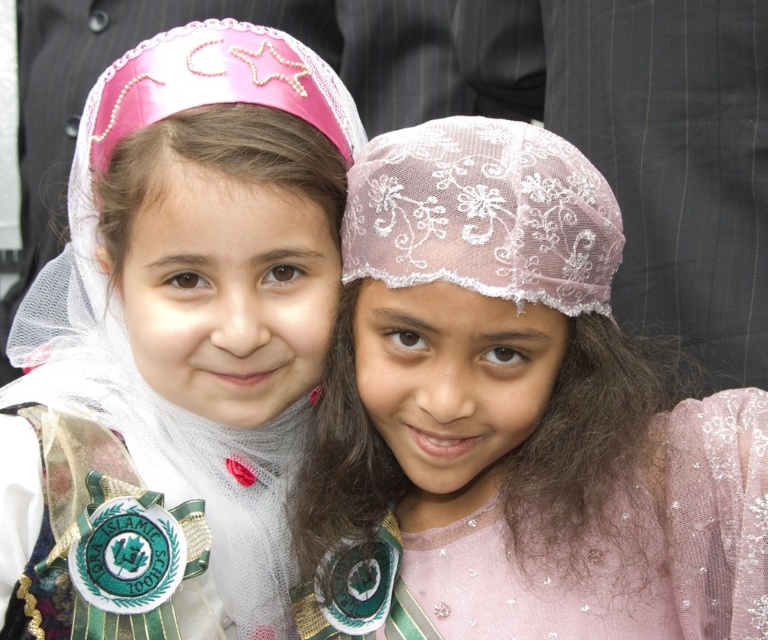
Is point (298, 285) in front of point (528, 196)?

No, it is behind (528, 196).

Looking at this image, can you confirm if matte pink crown at upper left is positioned above lace fabric headscarf at upper center?

No, matte pink crown at upper left is not above lace fabric headscarf at upper center.

Which is in front, point (15, 410) or point (596, 198)?

Point (596, 198) is in front.

What are the coordinates of `matte pink crown at upper left` in the screenshot? It's located at (x=174, y=344).

Which is more to the right, pink lace headscarf at center or matte pink crown at upper left?

Positioned to the right is pink lace headscarf at center.

Is pink lace headscarf at center to the right of matte pink crown at upper left from the viewer's perspective?

Correct, you'll find pink lace headscarf at center to the right of matte pink crown at upper left.

The width and height of the screenshot is (768, 640). I want to click on pink lace headscarf at center, so click(x=515, y=416).

Can you confirm if pink lace headscarf at center is positioned to the left of lace fabric headscarf at upper center?

In fact, pink lace headscarf at center is to the right of lace fabric headscarf at upper center.

How distant is pink lace headscarf at center from lace fabric headscarf at upper center?

pink lace headscarf at center and lace fabric headscarf at upper center are 5.89 inches apart.

Which is behind, point (564, 365) or point (550, 230)?

Positioned behind is point (564, 365).

Image resolution: width=768 pixels, height=640 pixels. Identify the location of pink lace headscarf at center. (515, 416).